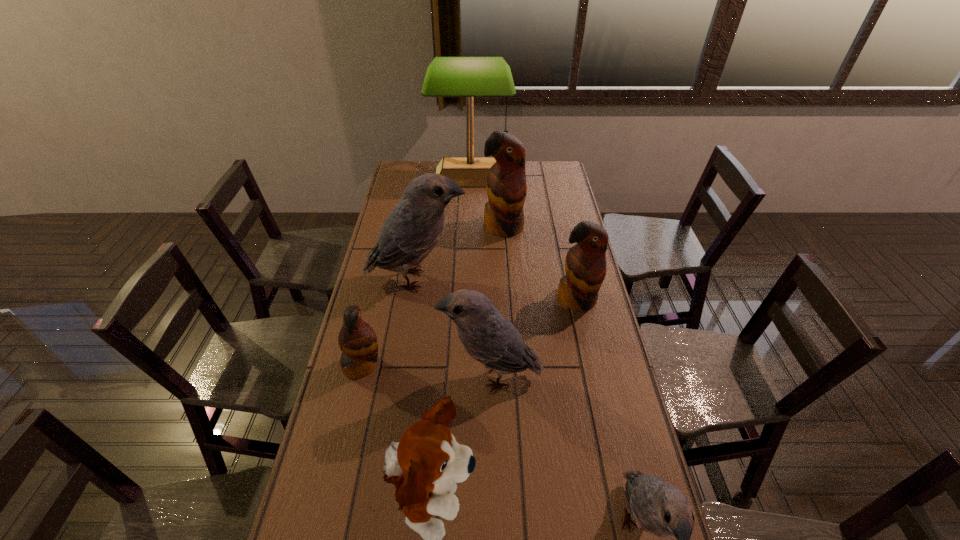
This screenshot has height=540, width=960. In order to click on free region located 0.320m on the metallic stand of the green table lamp in this screenshot , I will do (468, 235).

The width and height of the screenshot is (960, 540). I want to click on vacant space located on the front-facing side of the biggest gray parrot, so click(513, 280).

The width and height of the screenshot is (960, 540). I want to click on vacant space located 0.320m on the face of the second farthest object, so tap(508, 296).

The width and height of the screenshot is (960, 540). What are the coordinates of `vacant space located 0.330m on the face of the rightmost red parrot` in the screenshot? It's located at [x=599, y=400].

The image size is (960, 540). I want to click on blank space located on the front-facing side of the second farthest gray parrot, so click(386, 376).

Identify the location of vacant space located on the front-facing side of the second farthest gray parrot. coord(372,376).

Locate an element on the screen. The image size is (960, 540). vacant region located 0.130m on the front-facing side of the second farthest gray parrot is located at coordinates (398, 376).

The width and height of the screenshot is (960, 540). What are the coordinates of `vacant area located on the face of the leftmost red parrot` in the screenshot? It's located at (426, 365).

Where is `object at the far edge`? The image size is (960, 540). object at the far edge is located at coordinates (469, 77).

Image resolution: width=960 pixels, height=540 pixels. Identify the location of object that is at the right edge. (585, 264).